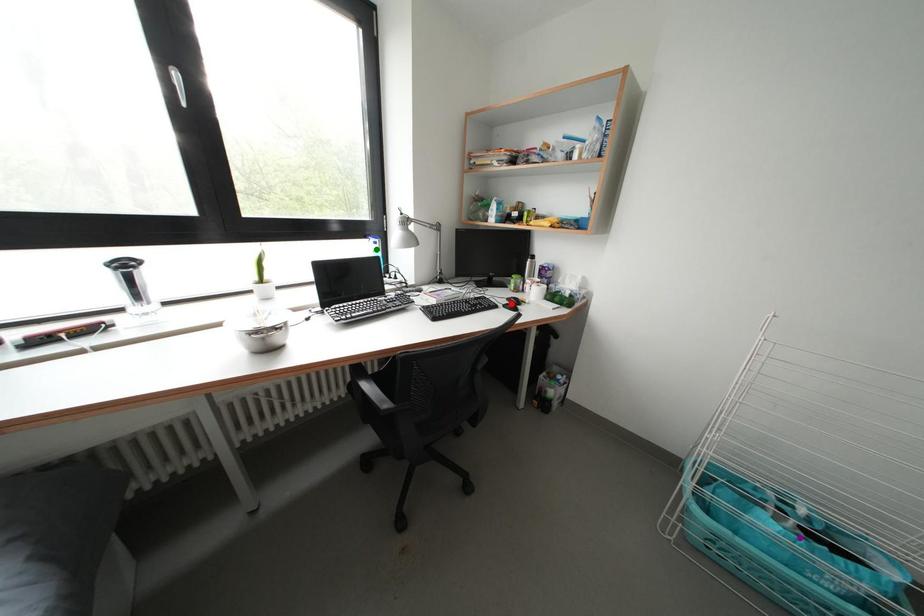
Order these from nearest to farthest:
- red point
- purple point
- green point

green point, red point, purple point